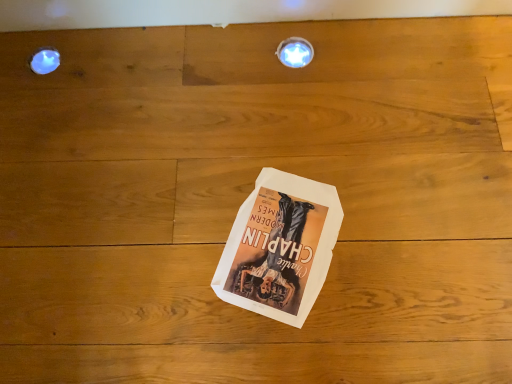
Identify the location of vacant area that is situated to the right of white paper at center. (394, 232).